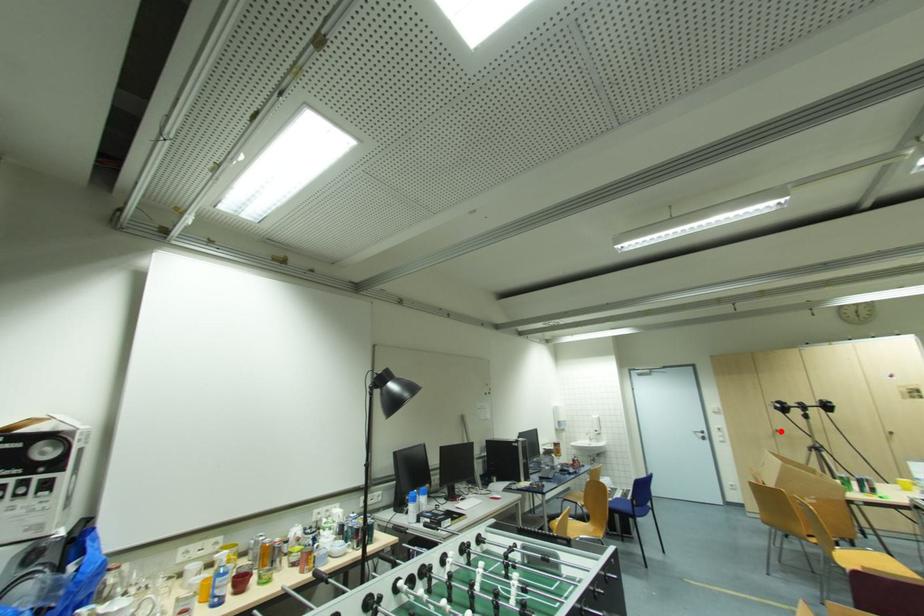
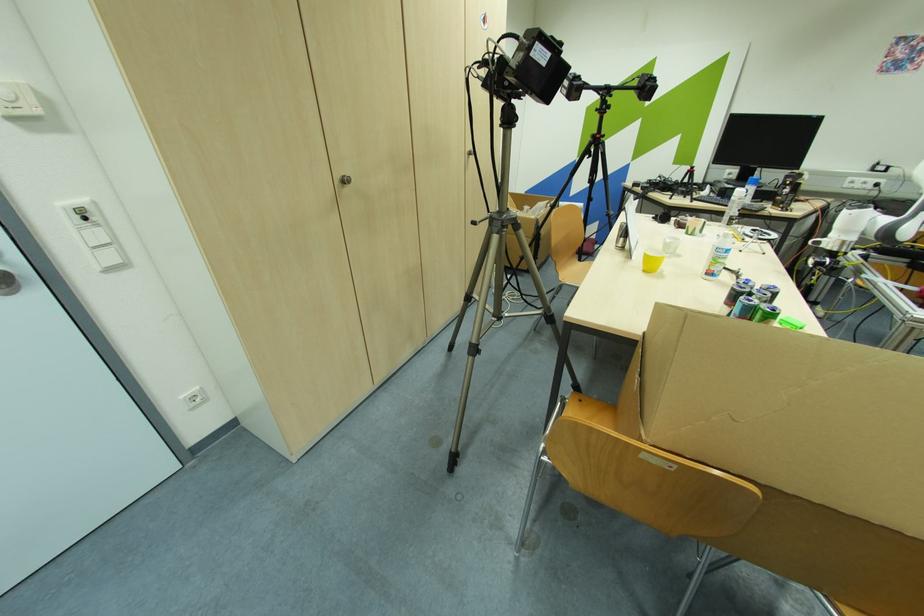
Question: I am providing you with two images of the same scene from different viewpoints. A red point is marked on the first image. Is the red point's position out of view in image 2?

Choices:
 (A) Yes
 (B) No

Answer: (B)